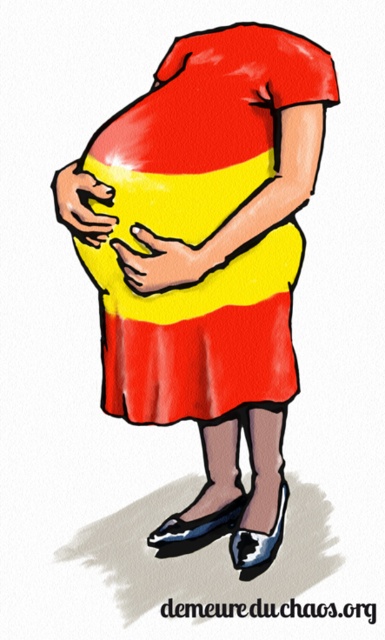
Question: Which point is closer to the camera taking this photo?

Choices:
 (A) (73, 225)
 (B) (155, 323)
 (C) (112, 240)
 (D) (274, 241)

Answer: (C)

Question: Which point is farther to the camera?

Choices:
 (A) (287, 294)
 (B) (289, 61)
 (C) (170, 276)
 (D) (68, 164)

Answer: (A)

Question: From the image, what is the correct spatial relationship of yellow matte hand at center in relation to matte yellow hand at center?

Choices:
 (A) above
 (B) below

Answer: (B)

Question: Can you confirm if matte red dress at center is positioned to the right of matte yellow hand at center?

Choices:
 (A) no
 (B) yes

Answer: (B)

Question: Which point is closer to the camera taking this photo?

Choices:
 (A) (284, 394)
 (B) (110, 243)
 (C) (95, 240)
 (D) (204, 372)

Answer: (B)

Question: Can you confirm if yellow matte dress at center is wider than matte yellow hand at center?

Choices:
 (A) no
 (B) yes

Answer: (B)